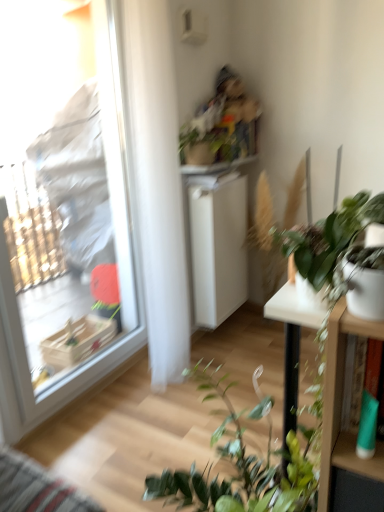
This screenshot has height=512, width=384. Describe the element at coordinates (218, 246) in the screenshot. I see `white matte cabinet at center` at that location.

What do you see at coordinates (67, 222) in the screenshot? The image size is (384, 512). I see `transparent plastic window at left` at bounding box center [67, 222].

Find the location of a particular element. The width and height of the screenshot is (384, 512). green matte plant at upper center, the 1th houseplant when ordered from back to front is located at coordinates (207, 143).

In order to click on white matte cabinet at center in this screenshot , I will do `click(218, 246)`.

Between green matte plant at right, which is the first houseplant from bottom to top, and white glossy table at right, which one has smaller width?

With smaller width is white glossy table at right.

Considering the sizes of objects green matte plant at right, which is the first houseplant from bottom to top, and white glossy table at right in the image provided, who is smaller, green matte plant at right, which is the first houseplant from bottom to top, or white glossy table at right?

Smaller between the two is white glossy table at right.

Can we say white matte cabinet at center lies outside transparent plastic window at left?

Indeed, white matte cabinet at center is completely outside transparent plastic window at left.

The width and height of the screenshot is (384, 512). What are the coordinates of `window in front of the white matte cabinet at center` in the screenshot? It's located at (67, 222).

From a real-world perspective, relative to transparent plastic window at left, is white matte cabinet at center vertically above or below?

white matte cabinet at center is below transparent plastic window at left.

Is white matte cabinet at center wider than transparent plastic window at left?

Yes, white matte cabinet at center is wider than transparent plastic window at left.

Looking at their sizes, would you say green matte plant at upper center, the 1th houseplant when ordered from back to front, is wider or thinner than green matte plant at right, the 1th houseplant positioned from the front?

green matte plant at upper center, the 1th houseplant when ordered from back to front, is wider than green matte plant at right, the 1th houseplant positioned from the front.

Is green matte plant at upper center, acting as the 1th houseplant starting from the top, at the right side of green matte plant at right, marked as the 2th houseplant in a back-to-front arrangement?

No, green matte plant at upper center, acting as the 1th houseplant starting from the top, is not to the right of green matte plant at right, marked as the 2th houseplant in a back-to-front arrangement.

Is green matte plant at upper center, the 1th houseplant when ordered from back to front, far from green matte plant at right, which is the first houseplant from bottom to top?

Yes, green matte plant at upper center, the 1th houseplant when ordered from back to front, and green matte plant at right, which is the first houseplant from bottom to top, are quite far apart.

Identify the location of houseplant to the right of green matte plant at upper center, acting as the 1th houseplant starting from the top. Image resolution: width=384 pixels, height=512 pixels. (334, 244).

Would you say white glossy table at right is inside or outside white matte cabinet at center?

white glossy table at right exists outside the volume of white matte cabinet at center.

What's the angular difference between white glossy table at right and white matte cabinet at center's facing directions?

They differ by 88.2 degrees in their facing directions.

Between white glossy table at right and white matte cabinet at center, which one has less height?

Standing shorter between the two is white glossy table at right.

The height and width of the screenshot is (512, 384). I want to click on table above the white matte cabinet at center (from a real-world perspective), so [x=339, y=424].

Measure the distance from white matte cabinet at center to green matte plant at upper center, the 1th houseplant when ordered from back to front.

A distance of 17.66 inches exists between white matte cabinet at center and green matte plant at upper center, the 1th houseplant when ordered from back to front.

Does white matte cabinet at center have a lesser height compared to green matte plant at upper center, the 2th houseplant viewed from the front?

In fact, white matte cabinet at center may be taller than green matte plant at upper center, the 2th houseplant viewed from the front.

Considering the sizes of white matte cabinet at center and green matte plant at upper center, acting as the 1th houseplant starting from the top, in the image, is white matte cabinet at center wider or thinner than green matte plant at upper center, acting as the 1th houseplant starting from the top,?

In the image, white matte cabinet at center appears to be more narrow than green matte plant at upper center, acting as the 1th houseplant starting from the top.

You are a GUI agent. You are given a task and a screenshot of the screen. Output one action in this format:
    pyautogui.click(x=<x>, y=<y>)
    Task: Click on the shelf behind the green matte plant at upper center, which is the second houseplant from bottom to top
    This screenshot has height=512, width=384.
    Given the screenshot: What is the action you would take?
    pyautogui.click(x=218, y=246)

How distant is transparent plastic window at left from green matte plant at right, marked as the 2th houseplant in a back-to-front arrangement?

They are 4.89 feet apart.

Between point (110, 313) and point (346, 281), which one is positioned in front?

The point (346, 281) is closer to the camera.

Is transparent plastic window at left positioned before green matte plant at right, the 1th houseplant positioned from the front?

No, transparent plastic window at left is further to the viewer.

Is point (89, 12) closer to camera compared to point (288, 286)?

No, (89, 12) is behind (288, 286).

Is transparent plastic window at left bigger or smaller than white glossy table at right?

transparent plastic window at left is bigger than white glossy table at right.

Is transparent plastic window at left beside white glossy table at right?

No, transparent plastic window at left is not making contact with white glossy table at right.

Locate an element on the screen. The width and height of the screenshot is (384, 512). table located in front of the green matte plant at right, marked as the 2th houseplant in a back-to-front arrangement is located at coordinates (339, 424).

Find the location of a particular element. This screenshot has height=512, width=384. shelf that is under the transparent plastic window at left (from a real-world perspective) is located at coordinates (218, 246).

Consider the image. From the image, which object appears to be nearer to white matte cabinet at center, transparent plastic window at left or green matte plant at upper center, acting as the 1th houseplant starting from the top?

The object closer to white matte cabinet at center is green matte plant at upper center, acting as the 1th houseplant starting from the top.

Estimate the real-world distances between objects in this image. Which object is further from green matte plant at right, the 1th houseplant positioned from the front, transparent plastic window at left or white matte cabinet at center?

transparent plastic window at left is positioned further to the anchor green matte plant at right, the 1th houseplant positioned from the front.

From the image, which object appears to be farther from green matte plant at upper center, the 2th houseplant viewed from the front, transparent plastic window at left or green matte plant at right, the second houseplant viewed from the top?

The object further to green matte plant at upper center, the 2th houseplant viewed from the front, is green matte plant at right, the second houseplant viewed from the top.

Looking at the image, which one is located further to white glossy table at right, white matte cabinet at center or green matte plant at upper center, the 2th houseplant viewed from the front?

Among the two, white matte cabinet at center is located further to white glossy table at right.

Based on their spatial positions, is green matte plant at upper center, the 1th houseplant when ordered from back to front, or transparent plastic window at left further from green matte plant at right, marked as the 2th houseplant in a back-to-front arrangement?

transparent plastic window at left.

Based on the photo, from the image, which object appears to be farther from white matte cabinet at center, transparent plastic window at left or white glossy table at right?

white glossy table at right.

Which object lies further to the anchor point transparent plastic window at left, white glossy table at right or green matte plant at upper center, which is the second houseplant from bottom to top?

Based on the image, white glossy table at right appears to be further to transparent plastic window at left.

Estimate the real-world distances between objects in this image. Which object is further from transparent plastic window at left, green matte plant at right, which is the first houseplant from bottom to top, or green matte plant at upper center, which is the second houseplant from bottom to top?

green matte plant at right, which is the first houseplant from bottom to top, is further to transparent plastic window at left.

You are a GUI agent. You are given a task and a screenshot of the screen. Output one action in this format:
    pyautogui.click(x=<x>, y=<y>)
    Task: Click on the window positioned between green matte plant at right, the 1th houseplant positioned from the front, and green matte plant at upper center, the 1th houseplant when ordered from back to front, from near to far
    Image resolution: width=384 pixels, height=512 pixels.
    Given the screenshot: What is the action you would take?
    pyautogui.click(x=67, y=222)

The width and height of the screenshot is (384, 512). Identify the location of houseplant between white glossy table at right and green matte plant at upper center, the 2th houseplant viewed from the front, from front to back. (334, 244).

The height and width of the screenshot is (512, 384). I want to click on houseplant positioned between green matte plant at right, the second houseplant viewed from the top, and white matte cabinet at center from near to far, so 207,143.

Where is `window located between white glossy table at right and green matte plant at upper center, acting as the 1th houseplant starting from the top, in the depth direction`? This screenshot has height=512, width=384. window located between white glossy table at right and green matte plant at upper center, acting as the 1th houseplant starting from the top, in the depth direction is located at coordinates (67, 222).